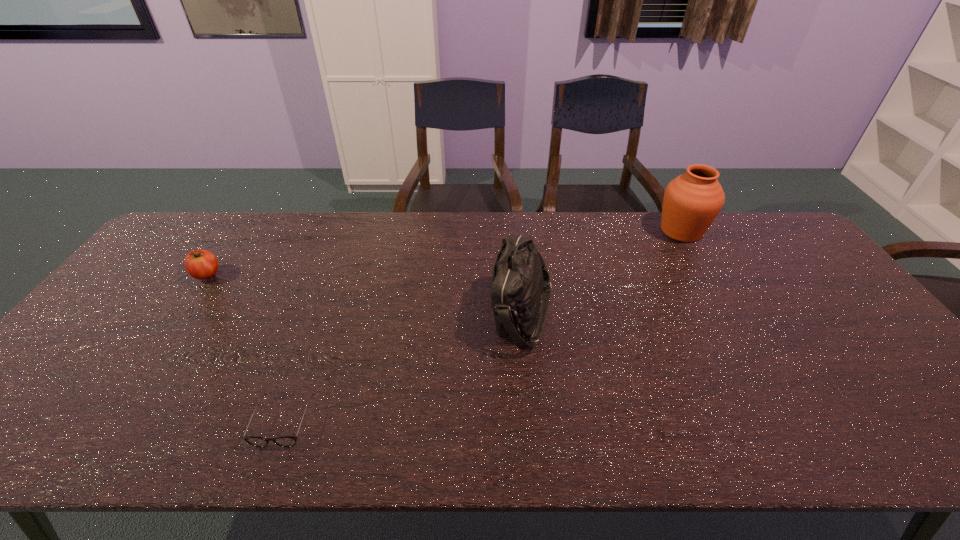
I want to click on empty space between the rightmost object and the third tallest object, so click(444, 253).

Identify the location of vacant area between the apple and the rightmost object. (444, 253).

At what (x,y) coordinates should I click in order to perform the action: click on free space between the shortest object and the shoulder bag. Please return your answer as a coordinate pair (x, y). Image resolution: width=960 pixels, height=540 pixels. Looking at the image, I should click on (403, 367).

You are a GUI agent. You are given a task and a screenshot of the screen. Output one action in this format:
    pyautogui.click(x=<x>, y=<y>)
    Task: Click on the free space between the leftmost object and the nearest object
    The width and height of the screenshot is (960, 540).
    Given the screenshot: What is the action you would take?
    pyautogui.click(x=245, y=348)

Identify the location of free area in between the nearest object and the urn. (483, 326).

The height and width of the screenshot is (540, 960). Find the location of `vacant space in between the third object from left to right and the second shortest object`. vacant space in between the third object from left to right and the second shortest object is located at coordinates (365, 294).

Image resolution: width=960 pixels, height=540 pixels. Find the location of `free space between the nearest object and the rightmost object`. free space between the nearest object and the rightmost object is located at coordinates (483, 326).

Locate an element on the screen. This screenshot has height=540, width=960. object that is the second nearest to the shoulder bag is located at coordinates (284, 441).

This screenshot has width=960, height=540. What are the coordinates of `object that stands as the third closest to the nearest object` in the screenshot? It's located at (692, 201).

Where is `vacant space that satisfies the following two spatial constraints: 1. at the front padded panel of the shoulder bag; 2. through the lenses of the shortest object`? This screenshot has width=960, height=540. vacant space that satisfies the following two spatial constraints: 1. at the front padded panel of the shoulder bag; 2. through the lenses of the shortest object is located at coordinates (533, 421).